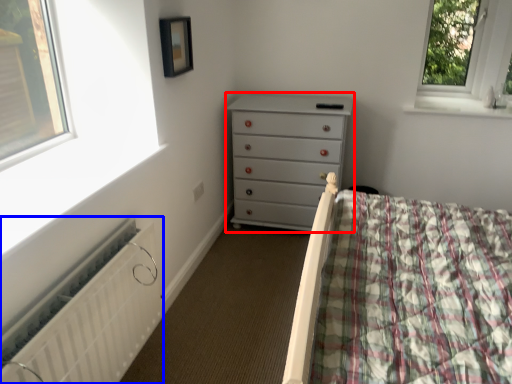
Question: Which object is further to the camera taking this photo, chest of drawers (highlighted by a red box) or radiator (highlighted by a blue box)?

Choices:
 (A) chest of drawers
 (B) radiator

Answer: (A)